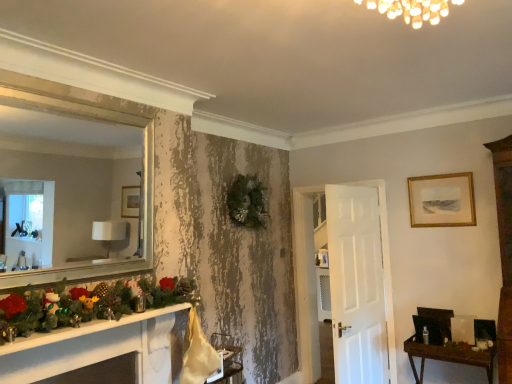
What do you see at coordinates (442, 200) in the screenshot? This screenshot has width=512, height=384. I see `gold-framed painting at upper right` at bounding box center [442, 200].

In order to face gold-framed painting at upper right, should I rotate leftwards or rightwards?

To face it directly, rotate right by 23.354 degrees.

Locate an element on the screen. The height and width of the screenshot is (384, 512). gold-framed painting at upper right is located at coordinates (442, 200).

Where is `brown wooden table at lower right`? This screenshot has width=512, height=384. brown wooden table at lower right is located at coordinates (448, 356).

Measure the distance between brown wooden table at lower right and camera.

The depth of brown wooden table at lower right is 9.62 feet.

Image resolution: width=512 pixels, height=384 pixels. Describe the element at coordinates (448, 356) in the screenshot. I see `brown wooden table at lower right` at that location.

This screenshot has width=512, height=384. I want to click on gold-framed painting at upper right, so click(x=442, y=200).

Is gold-framed painting at upper right to the left of brown wooden table at lower right from the viewer's perspective?

No, gold-framed painting at upper right is not to the left of brown wooden table at lower right.

Which is in front, gold-framed painting at upper right or brown wooden table at lower right?

brown wooden table at lower right.

Is point (421, 197) closer to viewer compared to point (472, 365)?

No, (421, 197) is further to viewer.

From the image's perspective, between gold-framed painting at upper right and brown wooden table at lower right, which one is located above?

gold-framed painting at upper right is shown above in the image.

From a real-world perspective, which object stands above the other?

gold-framed painting at upper right is physically above.

Looking at their sizes, would you say gold-framed painting at upper right is wider or thinner than brown wooden table at lower right?

Clearly, gold-framed painting at upper right has less width compared to brown wooden table at lower right.

Considering the sizes of objects gold-framed painting at upper right and brown wooden table at lower right in the image provided, who is shorter, gold-framed painting at upper right or brown wooden table at lower right?

With less height is gold-framed painting at upper right.

Considering the relative sizes of gold-framed painting at upper right and brown wooden table at lower right in the image provided, is gold-framed painting at upper right smaller than brown wooden table at lower right?

Correct, gold-framed painting at upper right occupies less space than brown wooden table at lower right.

Consider the image. Is brown wooden table at lower right surrounded by gold-framed painting at upper right?

Actually, brown wooden table at lower right is outside gold-framed painting at upper right.

Would you say gold-framed painting at upper right is a long distance from brown wooden table at lower right?

gold-framed painting at upper right is positioned a significant distance from brown wooden table at lower right.

Is gold-framed painting at upper right oriented away from brown wooden table at lower right?

That's not correct — gold-framed painting at upper right is not looking away from brown wooden table at lower right.

Can you tell me how much gold-framed painting at upper right and brown wooden table at lower right differ in facing direction?

gold-framed painting at upper right and brown wooden table at lower right are facing 0.384 degrees away from each other.

Identify the location of picture frame that is on the right side of brown wooden table at lower right. The width and height of the screenshot is (512, 384). (x=442, y=200).

Considering the relative positions of brown wooden table at lower right and gold-framed painting at upper right in the image provided, is brown wooden table at lower right to the right of gold-framed painting at upper right from the viewer's perspective?

No.

Looking at this image, which object is more forward, brown wooden table at lower right or gold-framed painting at upper right?

brown wooden table at lower right is in front.

Which point is more forward, (424, 348) or (421, 185)?

The point (424, 348) is in front.

From the image's perspective, would you say brown wooden table at lower right is positioned over gold-framed painting at upper right?

No, from the image's perspective, brown wooden table at lower right is not on top of gold-framed painting at upper right.

Based on the photo, from a real-world perspective, is brown wooden table at lower right over gold-framed painting at upper right?

No.

Can you confirm if brown wooden table at lower right is thinner than gold-framed painting at upper right?

No, brown wooden table at lower right is not thinner than gold-framed painting at upper right.

Does brown wooden table at lower right have a lesser height compared to gold-framed painting at upper right?

Incorrect, the height of brown wooden table at lower right does not fall short of that of gold-framed painting at upper right.

Does brown wooden table at lower right have a larger size compared to gold-framed painting at upper right?

Indeed, brown wooden table at lower right has a larger size compared to gold-framed painting at upper right.

Is brown wooden table at lower right located outside gold-framed painting at upper right?

Yes, brown wooden table at lower right is not within gold-framed painting at upper right.

Is brown wooden table at lower right far from gold-framed painting at upper right?

Yes, brown wooden table at lower right and gold-framed painting at upper right are located far from each other.

Is brown wooden table at lower right turned away from gold-framed painting at upper right?

brown wooden table at lower right does not have its back to gold-framed painting at upper right.

How much distance is there between brown wooden table at lower right and gold-framed painting at upper right?

The distance of brown wooden table at lower right from gold-framed painting at upper right is 1.13 meters.

Where is `picture frame on the right side of brown wooden table at lower right`? picture frame on the right side of brown wooden table at lower right is located at coordinates (442, 200).

This screenshot has height=384, width=512. Find the location of `table below the gold-framed painting at upper right (from a real-world perspective)`. table below the gold-framed painting at upper right (from a real-world perspective) is located at coordinates (448, 356).

The width and height of the screenshot is (512, 384). Find the location of `picture frame on the right of the brown wooden table at lower right`. picture frame on the right of the brown wooden table at lower right is located at coordinates (442, 200).